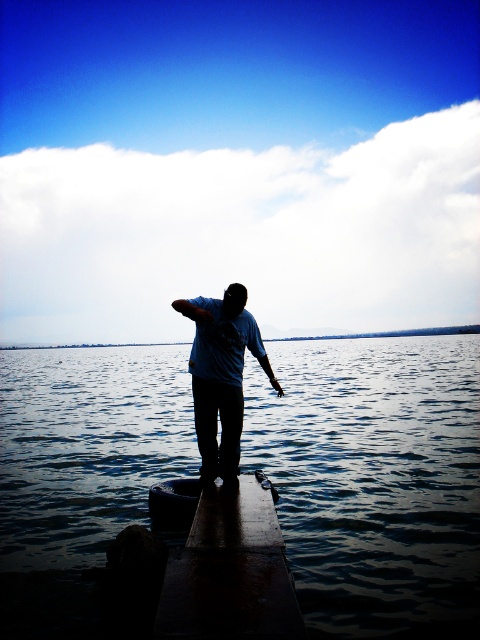
Question: Does dark wood dock at center have a larger size compared to matte blue shirt at center?

Choices:
 (A) no
 (B) yes

Answer: (A)

Question: Considering the real-world distances, which object is closest to the dark blue water at center?

Choices:
 (A) matte blue shirt at center
 (B) dark wood dock at center

Answer: (A)

Question: Can you confirm if dark blue water at center is positioned to the left of matte blue shirt at center?

Choices:
 (A) no
 (B) yes

Answer: (A)

Question: Can you confirm if dark blue water at center is smaller than matte blue shirt at center?

Choices:
 (A) no
 (B) yes

Answer: (A)

Question: Which point is closer to the camera?

Choices:
 (A) (173, 630)
 (B) (76, 372)

Answer: (A)

Question: Considering the real-world distances, which object is closest to the dark blue water at center?

Choices:
 (A) dark wood dock at center
 (B) matte blue shirt at center

Answer: (B)